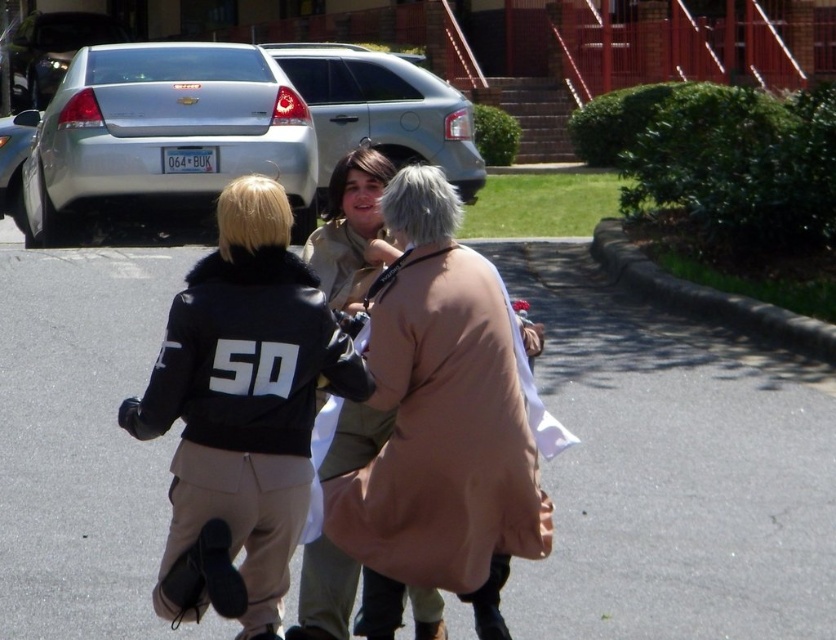
Is tan leather coat at center above satin silver suv at upper center?

No.

Is tan leather coat at center wider than satin silver suv at upper center?

In fact, tan leather coat at center might be narrower than satin silver suv at upper center.

Between point (510, 426) and point (339, 64), which one is positioned behind?

Positioned behind is point (339, 64).

What are the coordinates of `tan leather coat at center` in the screenshot? It's located at (441, 413).

Between satin silver suv at upper center and satin silver sedan at upper left, which one is positioned higher?

satin silver sedan at upper left is higher up.

The image size is (836, 640). I want to click on satin silver suv at upper center, so click(381, 109).

Where is `satin silver suv at upper center`? The height and width of the screenshot is (640, 836). satin silver suv at upper center is located at coordinates (381, 109).

Does black leather jacket at center have a smaller size compared to silver metallic sedan at upper left?

Correct, black leather jacket at center occupies less space than silver metallic sedan at upper left.

How distant is black leather jacket at center from silver metallic sedan at upper left?

They are 7.16 meters apart.

Locate an element on the screen. black leather jacket at center is located at coordinates (242, 412).